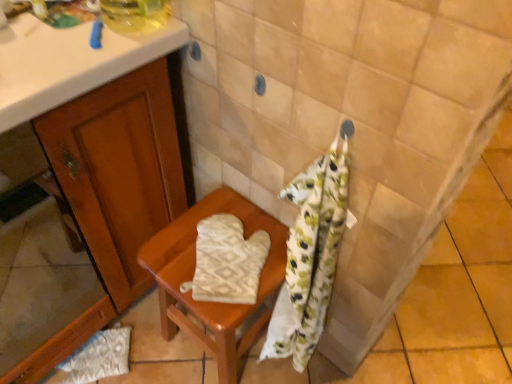
Locate an element on the screen. vacant space underneath white textured oven mitt at lower left (from a real-world perspective) is located at coordinates (113, 357).